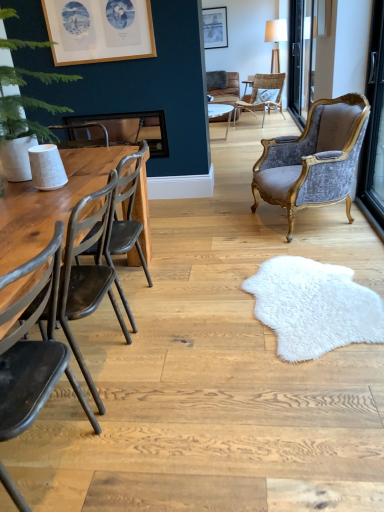
Question: Does matte silver picture frame at upper center, which ranks as the 1th picture frame in back-to-front order, have a lesser width compared to wooden frame at upper left, acting as the 1th picture frame starting from the front?

Choices:
 (A) no
 (B) yes

Answer: (A)

Question: Can you confirm if matte silver picture frame at upper center, positioned as the 1th picture frame in right-to-left order, is wider than wooden frame at upper left, which appears as the 1th picture frame when viewed from the left?

Choices:
 (A) yes
 (B) no

Answer: (A)

Question: From the image's perspective, would you say matte silver picture frame at upper center, the 2th picture frame when ordered from left to right, is shown under wooden frame at upper left, arranged as the second picture frame when viewed from the back?

Choices:
 (A) no
 (B) yes

Answer: (A)

Question: Is matte silver picture frame at upper center, which appears as the first picture frame when viewed from the top, taller than wooden frame at upper left, which appears as the 1th picture frame when viewed from the left?

Choices:
 (A) yes
 (B) no

Answer: (A)

Question: Is matte silver picture frame at upper center, acting as the 2th picture frame starting from the bottom, located outside wooden frame at upper left, which appears as the 1th picture frame when viewed from the left?

Choices:
 (A) no
 (B) yes

Answer: (B)

Question: Considering the relative positions of matte black chair at left, positioned as the 1th chair in front-to-back order, and wooden frame at upper left, the first picture frame in the bottom-to-top sequence, in the image provided, is matte black chair at left, positioned as the 1th chair in front-to-back order, to the left or to the right of wooden frame at upper left, the first picture frame in the bottom-to-top sequence,?

Choices:
 (A) right
 (B) left

Answer: (A)

Question: Is point (29, 407) positioned closer to the camera than point (99, 35)?

Choices:
 (A) farther
 (B) closer

Answer: (B)

Question: Looking at the image, does matte black chair at left, the 1th chair from the bottom, seem bigger or smaller compared to wooden frame at upper left, arranged as the second picture frame when viewed from the back?

Choices:
 (A) small
 (B) big

Answer: (B)

Question: From a real-world perspective, is matte black chair at left, the 1th chair from the bottom, positioned above or below wooden frame at upper left, acting as the 1th picture frame starting from the front?

Choices:
 (A) above
 (B) below

Answer: (B)

Question: Is point click(9, 222) closer or farther from the camera than point click(44, 45)?

Choices:
 (A) farther
 (B) closer

Answer: (B)

Question: Considering the positions of wooden table at left and green leafy plant at left in the image, is wooden table at left taller or shorter than green leafy plant at left?

Choices:
 (A) short
 (B) tall

Answer: (B)

Question: Based on their positions, is wooden table at left located to the left or right of green leafy plant at left?

Choices:
 (A) right
 (B) left

Answer: (A)

Question: From a real-world perspective, is wooden table at left above or below green leafy plant at left?

Choices:
 (A) below
 (B) above

Answer: (A)

Question: Is point (291, 31) positioned closer to the camera than point (266, 187)?

Choices:
 (A) farther
 (B) closer

Answer: (A)

Question: From the image's perspective, is transparent glass door at upper right located above or below velvet/gold armchair at right, the second chair viewed from the top?

Choices:
 (A) above
 (B) below

Answer: (A)